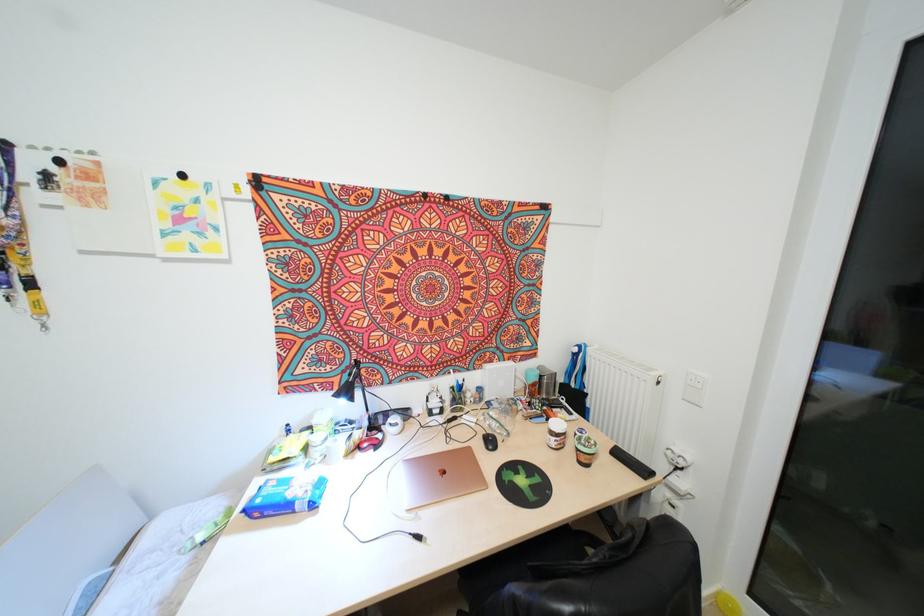
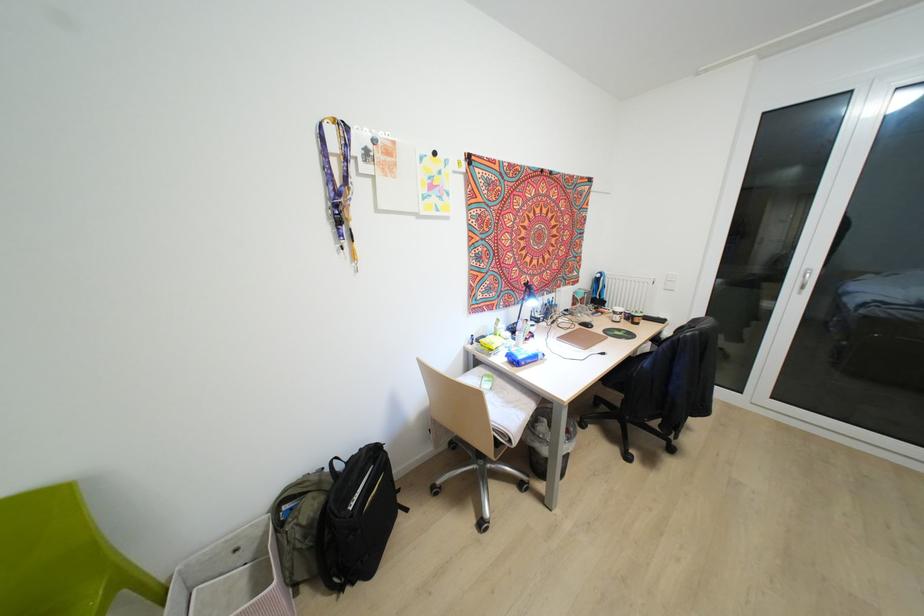
Find the pixel in the second image that matches [256,514] in the first image.

(523, 363)